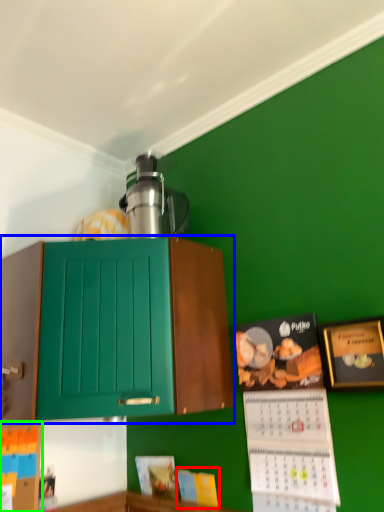
Question: Estimate the real-world distances between objects in this image. Which object is farther from book (highlighted by a red box), cabinetry (highlighted by a blue box) or book (highlighted by a green box)?

Choices:
 (A) cabinetry
 (B) book

Answer: (A)